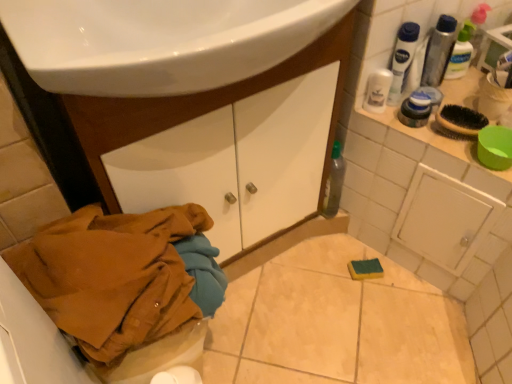
At what (x,y) coordinates should I click in order to perform the action: click on free location in front of translucent plastic mouthwash at upper right, positioned as the 2th mouthwash in right-to-left order. Please return your answer as a coordinate pair (x, y). The image size is (512, 384). Looking at the image, I should click on (449, 116).